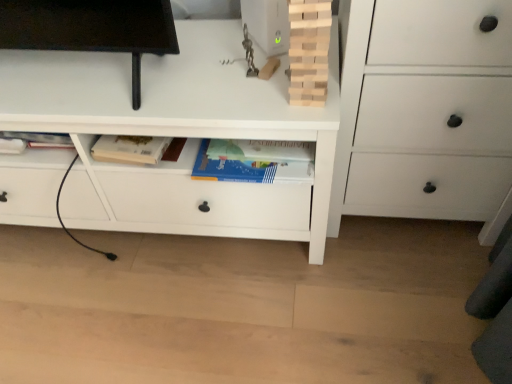
Question: Does white matte chest of drawers at center, the first chest of drawers when ordered from left to right, have a lesser height compared to natural wood tower at upper center?

Choices:
 (A) yes
 (B) no

Answer: (B)

Question: Is natural wood tower at upper center a part of white matte chest of drawers at center, the first chest of drawers when ordered from left to right?

Choices:
 (A) no
 (B) yes

Answer: (A)

Question: Is white matte chest of drawers at center, the first chest of drawers when ordered from left to right, to the left of natural wood tower at upper center from the viewer's perspective?

Choices:
 (A) no
 (B) yes

Answer: (B)

Question: Is white matte chest of drawers at center, the second chest of drawers when ordered from right to left, smaller than natural wood tower at upper center?

Choices:
 (A) yes
 (B) no

Answer: (B)

Question: Does white matte chest of drawers at center, the first chest of drawers when ordered from left to right, come in front of natural wood tower at upper center?

Choices:
 (A) no
 (B) yes

Answer: (A)

Question: Does white matte chest of drawers at center, the second chest of drawers when ordered from right to left, lie behind natural wood tower at upper center?

Choices:
 (A) no
 (B) yes

Answer: (B)

Question: Is white matte chest of drawers at center, the second chest of drawers when ordered from right to left, taller than white matte chest of drawers at right, which ranks as the 1th chest of drawers in right-to-left order?

Choices:
 (A) yes
 (B) no

Answer: (B)

Question: Can you confirm if white matte chest of drawers at center, the first chest of drawers when ordered from left to right, is wider than white matte chest of drawers at right, which ranks as the 1th chest of drawers in right-to-left order?

Choices:
 (A) no
 (B) yes

Answer: (B)

Question: Does white matte chest of drawers at center, the first chest of drawers when ordered from left to right, lie behind white matte chest of drawers at right, the second chest of drawers from the left?

Choices:
 (A) yes
 (B) no

Answer: (A)

Question: Is white matte chest of drawers at center, the second chest of drawers when ordered from right to left, oriented away from white matte chest of drawers at right, the second chest of drawers from the left?

Choices:
 (A) no
 (B) yes

Answer: (A)

Question: From the image's perspective, would you say white matte chest of drawers at center, the second chest of drawers when ordered from right to left, is positioned over white matte chest of drawers at right, the second chest of drawers from the left?

Choices:
 (A) yes
 (B) no

Answer: (B)

Question: Could you tell me if white matte chest of drawers at center, the second chest of drawers when ordered from right to left, is turned towards white matte chest of drawers at right, the second chest of drawers from the left?

Choices:
 (A) yes
 (B) no

Answer: (B)

Question: From a real-world perspective, is white matte chest of drawers at right, which ranks as the 1th chest of drawers in right-to-left order, physically above natural wood tower at upper center?

Choices:
 (A) no
 (B) yes

Answer: (A)